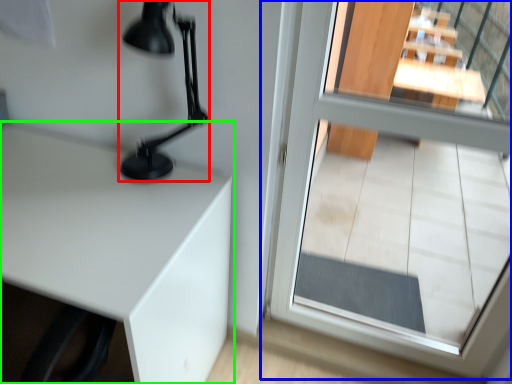
Question: Estimate the real-world distances between objects in this image. Which object is closer to table lamp (highlighted by a red box), glass door (highlighted by a blue box) or table (highlighted by a green box)?

Choices:
 (A) glass door
 (B) table

Answer: (B)